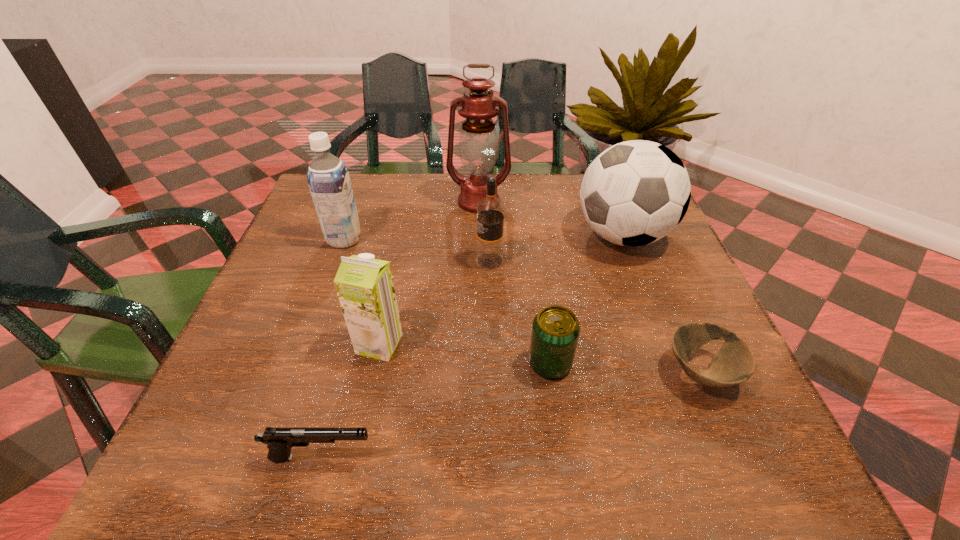
This screenshot has height=540, width=960. In order to click on oil lamp in this screenshot , I will do pos(478,144).

At what (x,y) coordinates should I click in order to perform the action: click on the farther soya milk. Please return your answer as a coordinate pair (x, y). Looking at the image, I should click on (328, 178).

Identify the location of the left soya milk. (328, 178).

Image resolution: width=960 pixels, height=540 pixels. In order to click on soccer ball in this screenshot , I will do point(634,193).

Locate an element on the screen. The image size is (960, 540). vodka is located at coordinates (490, 210).

I want to click on the right soya milk, so click(364, 285).

Locate an element on the screen. The height and width of the screenshot is (540, 960). the nearer soya milk is located at coordinates (364, 285).

What are the coordinates of `the third object from right to left` in the screenshot? It's located at (555, 331).

You are a GUI agent. You are given a task and a screenshot of the screen. Output one action in this format:
    pyautogui.click(x=<x>, y=<y>)
    Task: Click on the beer can
    This screenshot has width=960, height=540.
    Given the screenshot: What is the action you would take?
    pyautogui.click(x=555, y=331)

Find the location of a particular element. This screenshot has width=960, height=540. gun is located at coordinates (279, 440).